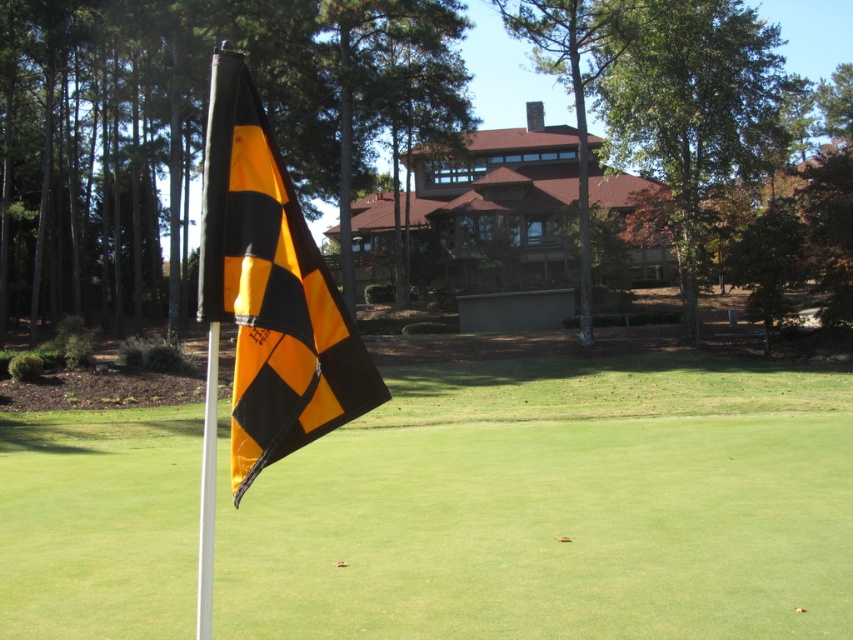
Question: Which is farther from the matte plastic flag at center?

Choices:
 (A) black/yellow checkered flag at center
 (B) white metallic pole at center

Answer: (A)

Question: Which object is closer to the camera taking this photo?

Choices:
 (A) matte plastic flag at center
 (B) white metallic pole at center
 (C) black/yellow checkered flag at center

Answer: (C)

Question: Which of the following is the farthest from the observer?

Choices:
 (A) matte plastic flag at center
 (B) black/yellow checkered flag at center

Answer: (A)

Question: Is matte plastic flag at center to the left of black/yellow checkered flag at center from the viewer's perspective?

Choices:
 (A) no
 (B) yes

Answer: (A)

Question: Is matte plastic flag at center smaller than black/yellow checkered flag at center?

Choices:
 (A) no
 (B) yes

Answer: (A)

Question: Can you confirm if black/yellow checkered flag at center is positioned to the right of white metallic pole at center?

Choices:
 (A) no
 (B) yes

Answer: (B)